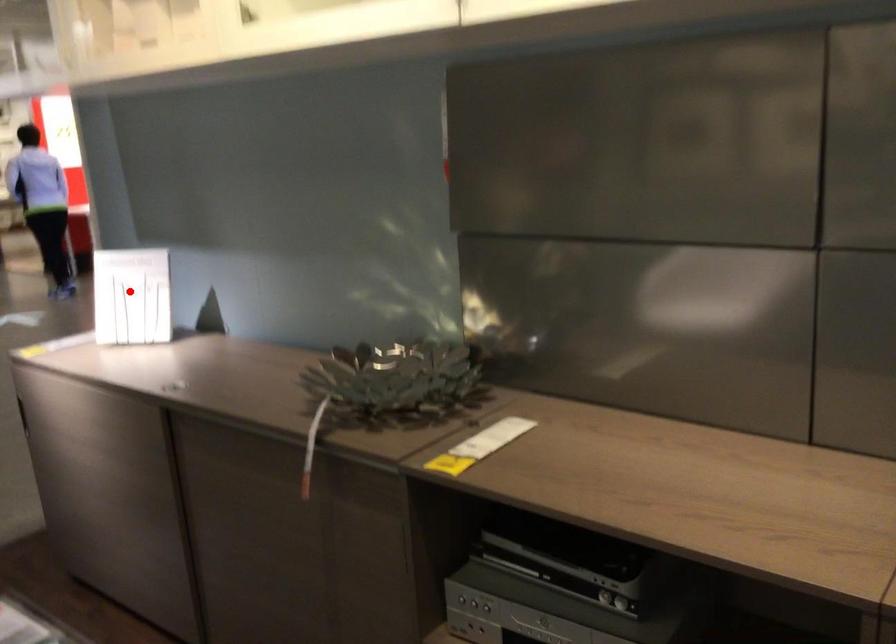
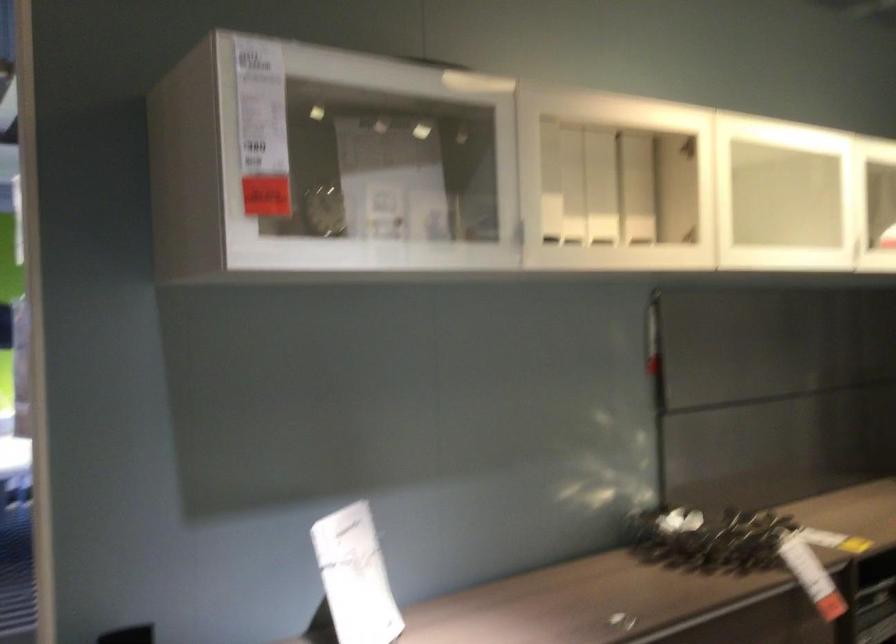
Find the pixel in the second image that matches the highlighted location in the first image.

(355, 576)